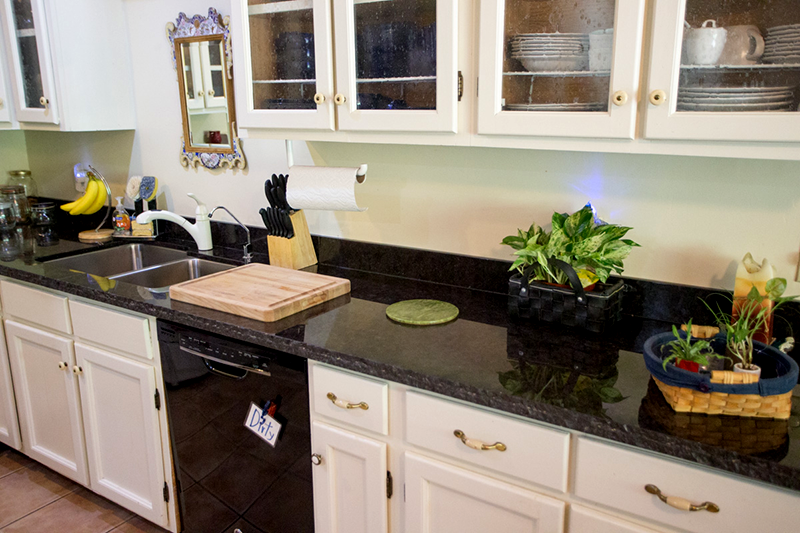
At what (x,y) coordinates should I click in order to perform the action: click on mirror. Please return your answer as a coordinate pair (x, y). Looking at the image, I should click on (198, 72).